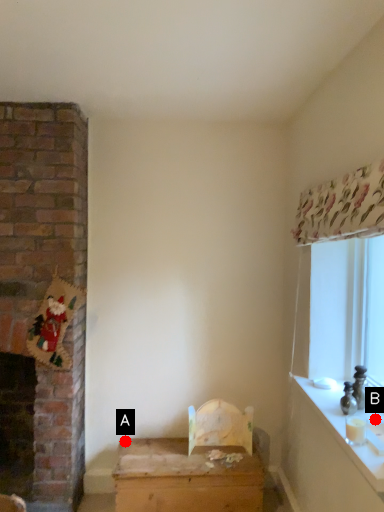
Question: Two points are circled on the image, labeled by A and B beside each circle. Which of the following is the farthest from the observer?

Choices:
 (A) A is further
 (B) B is further

Answer: (A)